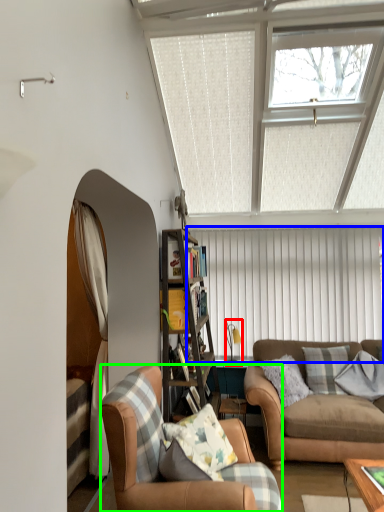
Question: Which is farther away from lamp (highlighted by a red box)? blind (highlighted by a blue box) or chair (highlighted by a green box)?

Choices:
 (A) blind
 (B) chair

Answer: (B)